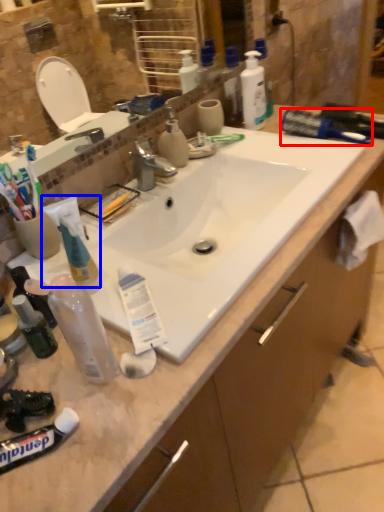
Question: Which object is closer to the camera taking this photo, brush (highlighted by a red box) or toothpaste (highlighted by a blue box)?

Choices:
 (A) brush
 (B) toothpaste

Answer: (B)